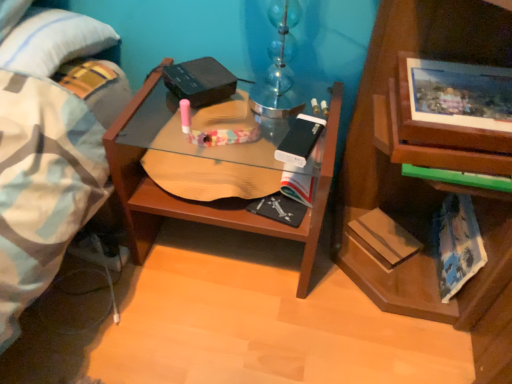
At what (x,y) coordinates should I click in order to perform the action: click on free space in front of wooden desk at center. Please return your answer as a coordinate pair (x, y). Looking at the image, I should click on (215, 331).